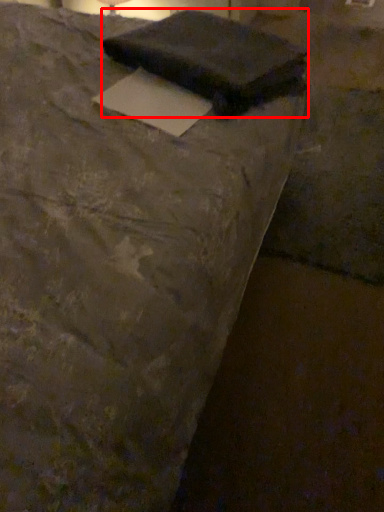
Question: From the image's perspective, considering the relative positions of writing (annotated by the red box) and writing in the image provided, where is writing (annotated by the red box) located with respect to the staircase?

Choices:
 (A) below
 (B) above

Answer: (B)